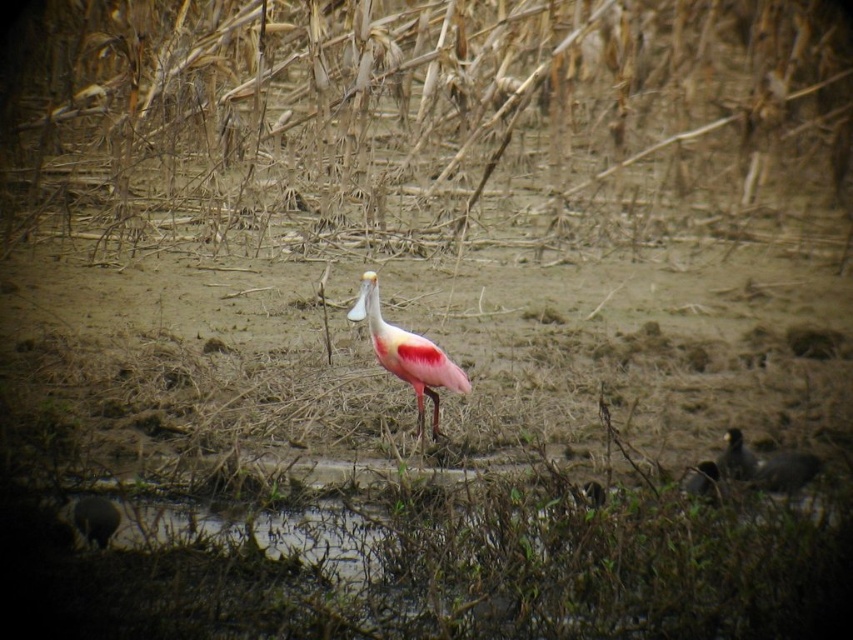
You are a birdwatcher observing the scene. You notice the pink feathered bird at lower right and the brown dry reed at center. Which object is closer to you?

The brown dry reed at center is closer to you because the pink feathered bird at lower right is behind it.